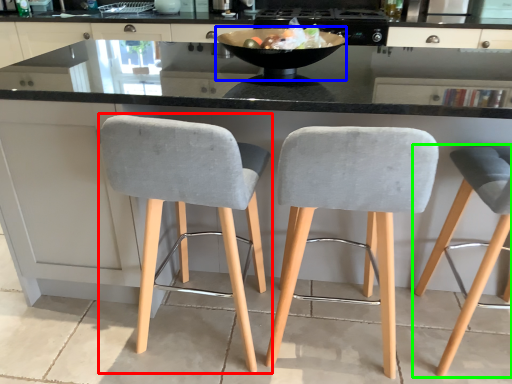
Question: Considering the real-world distances, which object is farthest from chair (highlighted by a red box)? bowl (highlighted by a blue box) or chair (highlighted by a green box)?

Choices:
 (A) bowl
 (B) chair

Answer: (B)